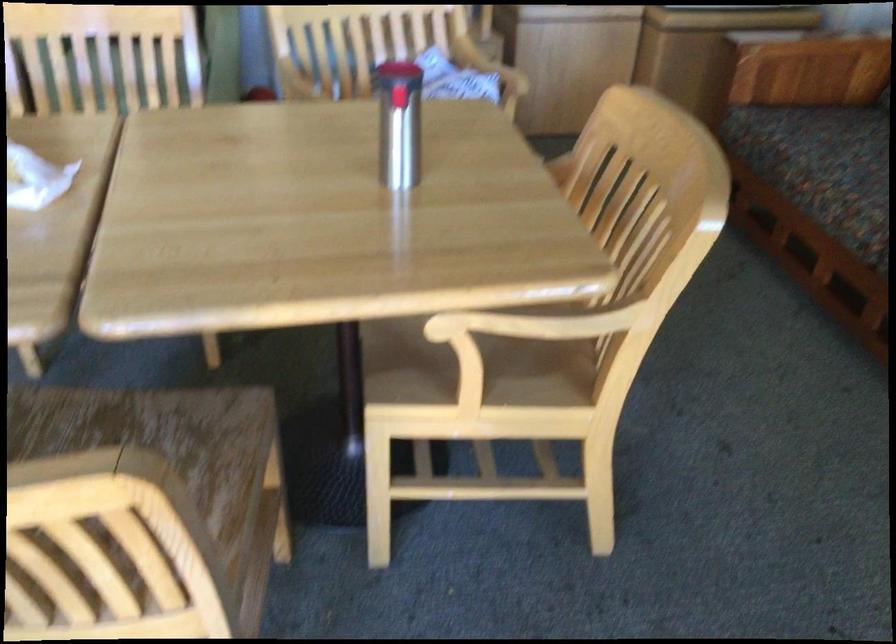
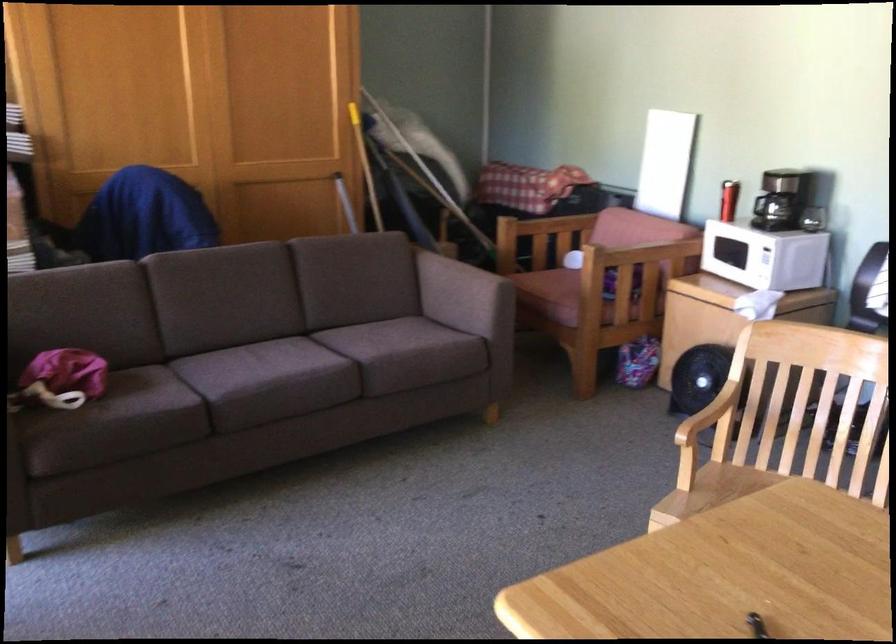
Question: The camera is either moving clockwise (left) or counter-clockwise (right) around the object. The first image is from the beginning of the video and the second image is from the end. Is the camera moving left or right when shooting the video?

Choices:
 (A) Left
 (B) Right

Answer: (B)